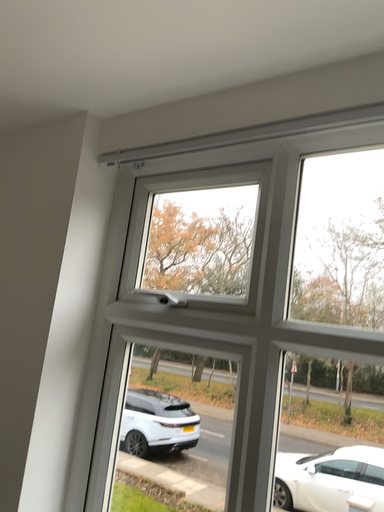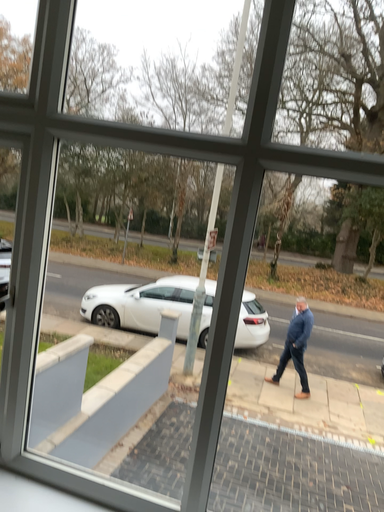
Question: How did the camera likely rotate when shooting the video?

Choices:
 (A) rotated right
 (B) rotated left

Answer: (A)